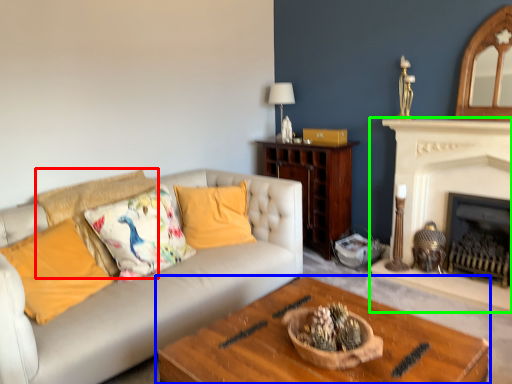
Question: Which object is positioned closest to pillow (highlighted by a red box)? Select from coffee table (highlighted by a blue box) and fireplace (highlighted by a green box).

Choices:
 (A) coffee table
 (B) fireplace

Answer: (A)